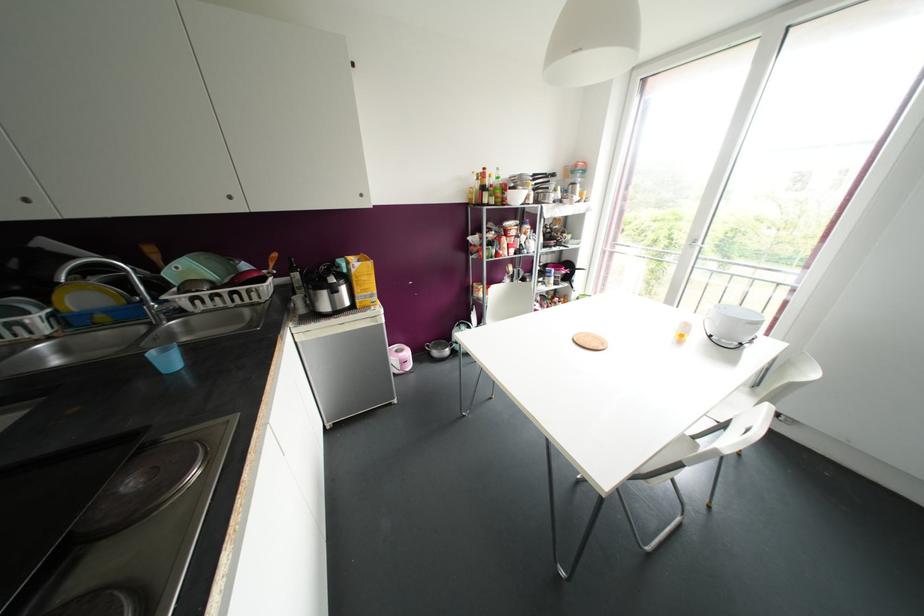
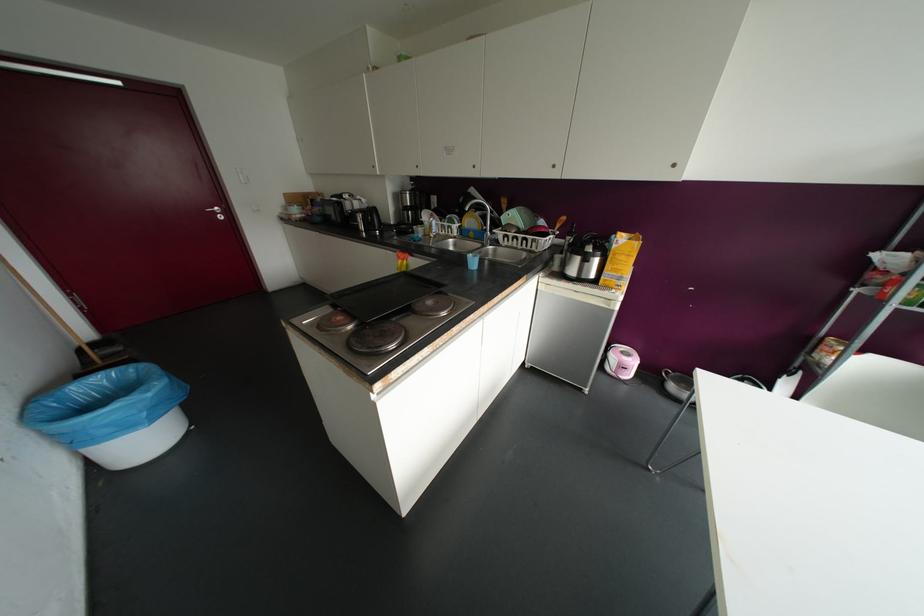
Where in the second image is the point corresponding to point (154, 299) from the first image?

(490, 230)